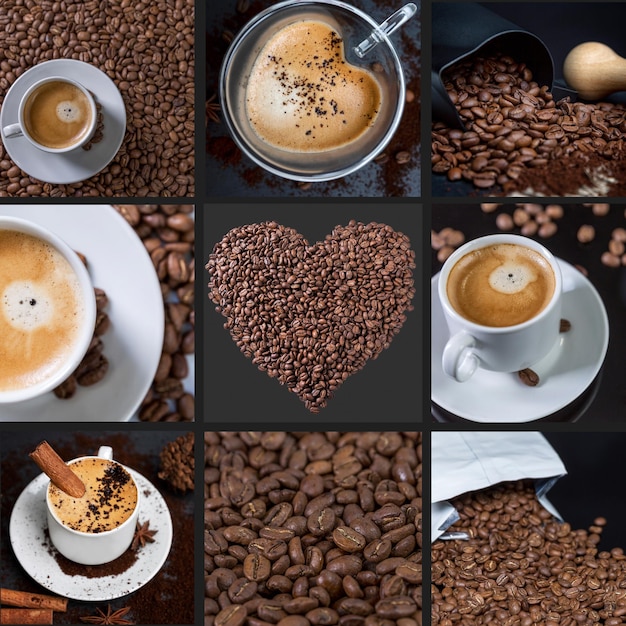
The height and width of the screenshot is (626, 626). Find the location of `mugs`. mugs is located at coordinates (325, 178), (73, 367), (528, 351), (83, 128).